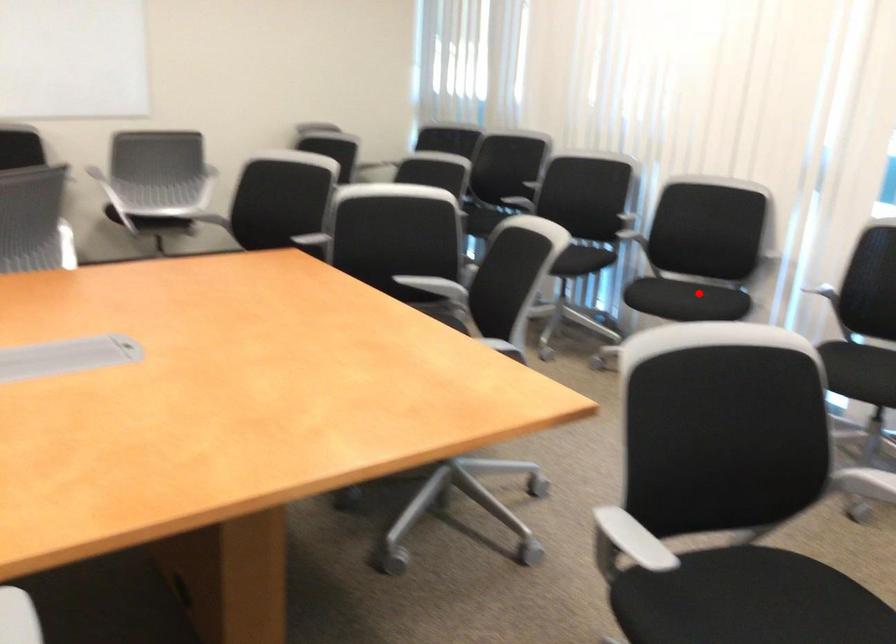
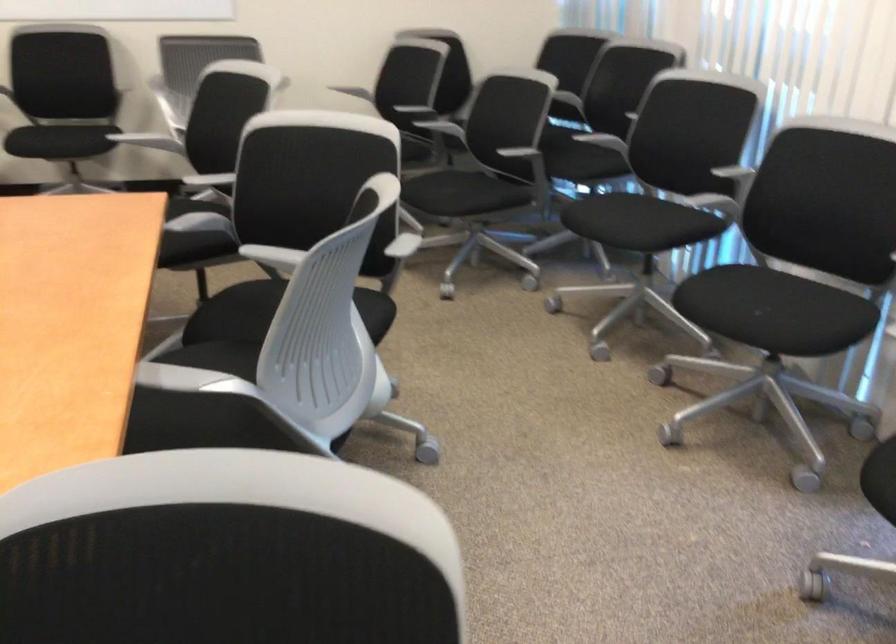
Find the pixel in the second image that matches the highlighted location in the first image.

(771, 310)